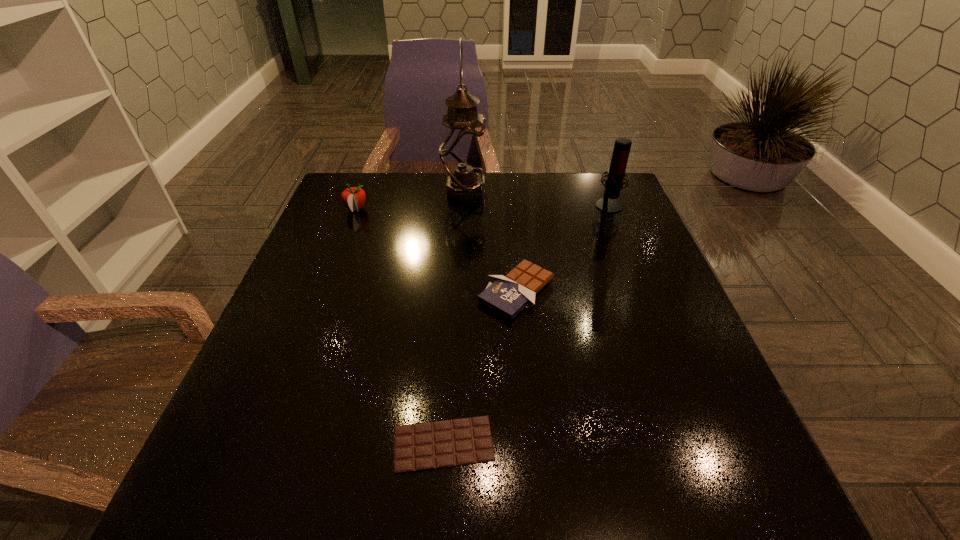
The width and height of the screenshot is (960, 540). In order to click on the tallest object in this screenshot , I will do `click(462, 152)`.

This screenshot has height=540, width=960. In order to click on the rightmost object in this screenshot , I will do `click(616, 173)`.

The width and height of the screenshot is (960, 540). I want to click on microphone, so click(x=616, y=173).

Identify the location of the leftmost object. (353, 198).

At what (x,y) coordinates should I click in order to perform the action: click on apple. Please return your answer as a coordinate pair (x, y). The image size is (960, 540). Looking at the image, I should click on (353, 198).

At what (x,y) coordinates should I click in order to perform the action: click on the farther chocolate bar. Please return your answer as a coordinate pair (x, y). Looking at the image, I should click on (508, 295).

Where is `the fourth farthest object`? The image size is (960, 540). the fourth farthest object is located at coordinates (508, 295).

Identify the location of the nearer chocolate bar. (440, 444).

Identify the location of the shortest object. This screenshot has width=960, height=540. (440, 444).

This screenshot has height=540, width=960. In order to click on free region located on the left of the tallest object in this screenshot , I will do `click(394, 192)`.